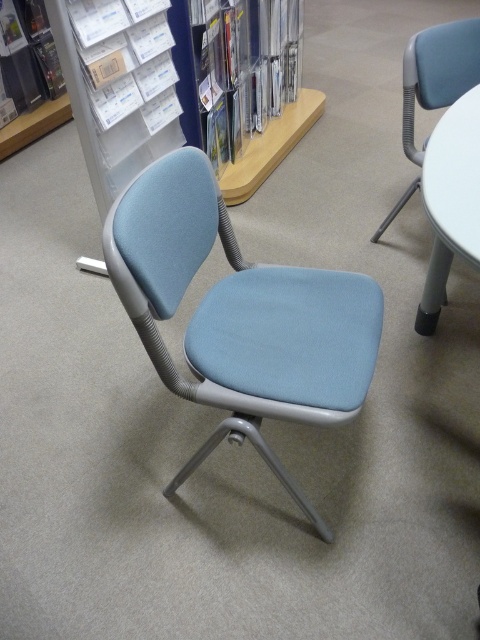
You are standing in front of the light blue office chair and notice two points marked on the chair. The points are labeled as point (x=456, y=234) and point (x=372, y=237). Which of these two points is closer to you?

Point (x=456, y=234) is closer to the viewer than point (x=372, y=237).